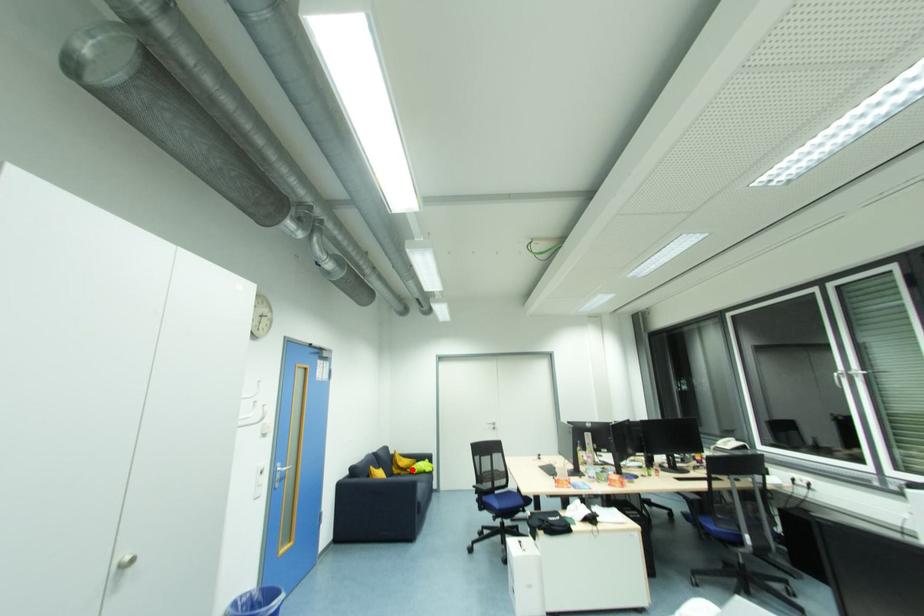
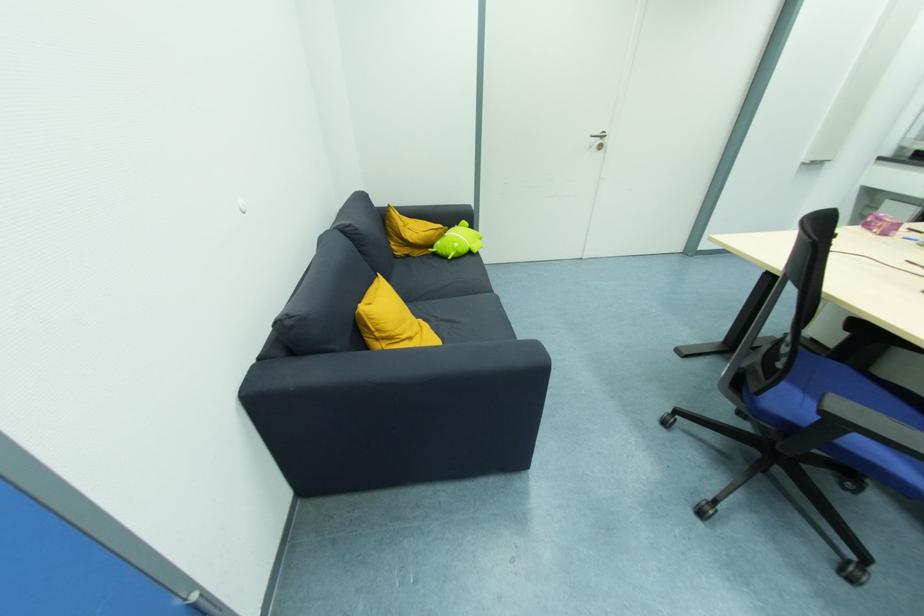
Where in the second image is the point corresponding to the highlighted location from the first image?

(435, 248)